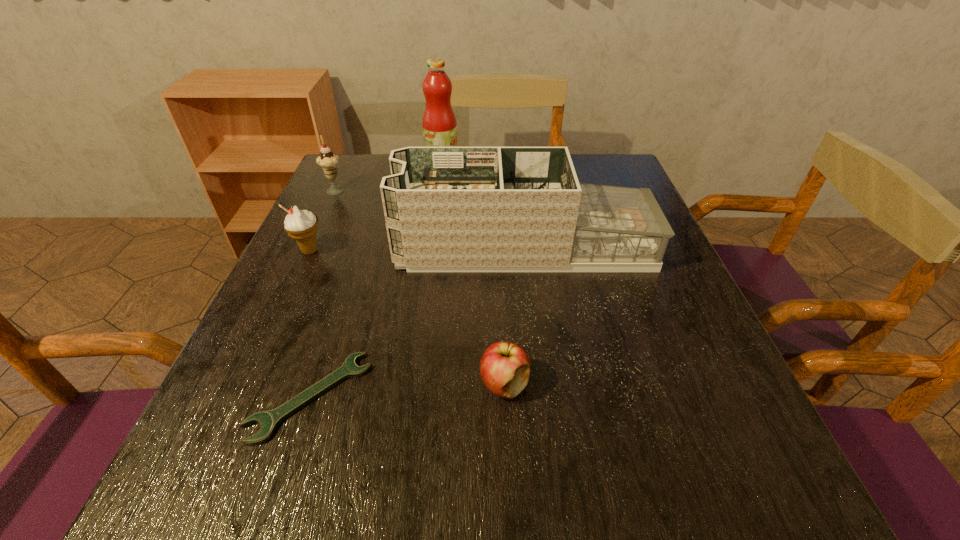
The height and width of the screenshot is (540, 960). I want to click on vacant space situated 0.220m at the entrance of the dollhouse, so click(300, 246).

Locate an element on the screen. vacant space located 0.090m at the entrance of the dollhouse is located at coordinates (358, 246).

Find the location of a particular element. This screenshot has width=960, height=540. free space located at the entrance of the dollhouse is located at coordinates (367, 246).

What are the coordinates of `vacant space located 0.350m on the right of the second farthest object` in the screenshot? It's located at (479, 190).

The image size is (960, 540). Identify the location of free space located 0.400m on the right of the shorter icecream. (507, 251).

Where is `vacant area situated 0.340m on the back of the apple`? vacant area situated 0.340m on the back of the apple is located at coordinates (497, 242).

This screenshot has height=540, width=960. What are the coordinates of `vacant space positioned on the front of the wrench` in the screenshot? It's located at (x=280, y=488).

The image size is (960, 540). In order to click on fruit juice located in the far edge section of the desktop in this screenshot , I will do `click(439, 123)`.

The height and width of the screenshot is (540, 960). Identify the location of icecream that is at the far edge. (327, 160).

Identify the location of wrench that is at the left edge. The image size is (960, 540). (269, 420).